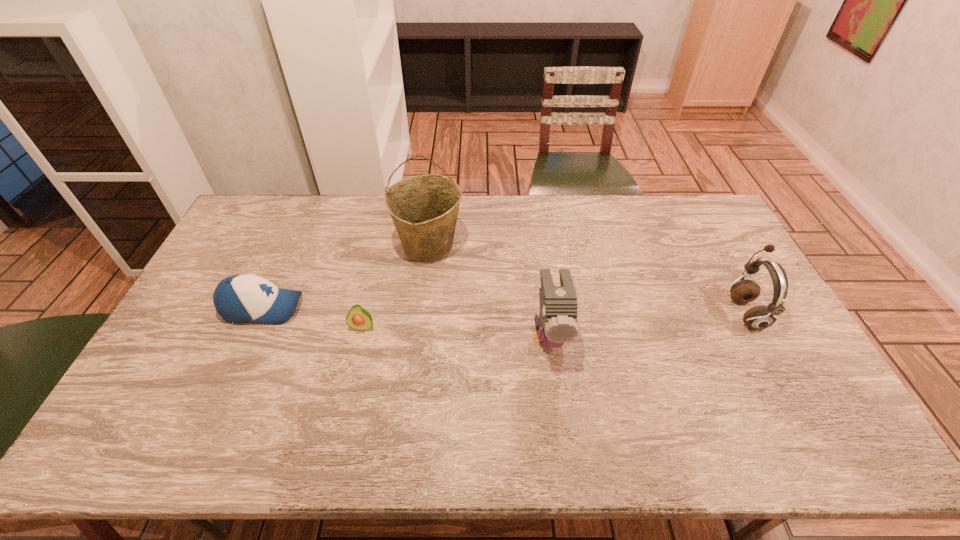
What are the coordinates of `vacant space that's between the rightmost object and the baseball cap` in the screenshot? It's located at (504, 310).

Where is `empty space that is in between the earphone and the farthest object`? This screenshot has width=960, height=540. empty space that is in between the earphone and the farthest object is located at coordinates point(588,279).

Find the location of a particular element. vacant space that's between the earphone and the bird is located at coordinates (647, 323).

The width and height of the screenshot is (960, 540). What are the coordinates of `free space between the baseball cap and the tallest object` in the screenshot? It's located at (346, 277).

Where is `free space between the avocado and the baseball cap`? free space between the avocado and the baseball cap is located at coordinates (313, 318).

This screenshot has height=540, width=960. Identify the location of blank region between the rightmost object and the wine bucket. click(x=588, y=279).

Identify the location of vacant space in between the bird and the second object from left to right. (456, 330).

What are the coordinates of `empty space between the avocado and the fourth object from left to right` in the screenshot? It's located at (456, 330).

This screenshot has height=540, width=960. In order to click on vacant space that is in between the wine bucket and the second object from left to right in this screenshot , I will do `click(396, 287)`.

Point out which object is positioned as the second nearest to the rightmost object. Please provide its 2D coordinates. Your answer should be formatted as a tuple, i.e. [(x, y)], where the tuple contains the x and y coordinates of a point satisfying the conditions above.

[(424, 208)]